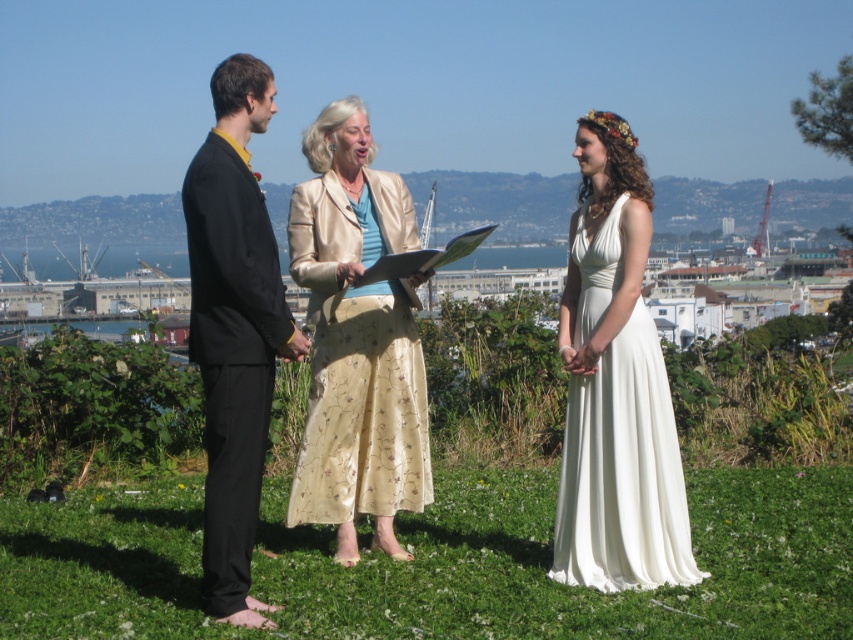
Question: Is matte black suit at left above satin beige skirt at center?

Choices:
 (A) no
 (B) yes

Answer: (B)

Question: Considering the relative positions of matte black suit at left and satin beige skirt at center in the image provided, where is matte black suit at left located with respect to satin beige skirt at center?

Choices:
 (A) right
 (B) left

Answer: (B)

Question: In this image, where is matte black suit at left located relative to satin beige skirt at center?

Choices:
 (A) left
 (B) right

Answer: (A)

Question: Which point is farther to the camera?

Choices:
 (A) (590, 493)
 (B) (260, 480)

Answer: (A)

Question: Which point is farther from the camera taking this photo?

Choices:
 (A) (659, 394)
 (B) (248, 204)
 (C) (387, 326)
 (D) (231, 518)

Answer: (C)

Question: Among these points, which one is farthest from the camera?

Choices:
 (A) (224, 490)
 (B) (653, 588)

Answer: (B)